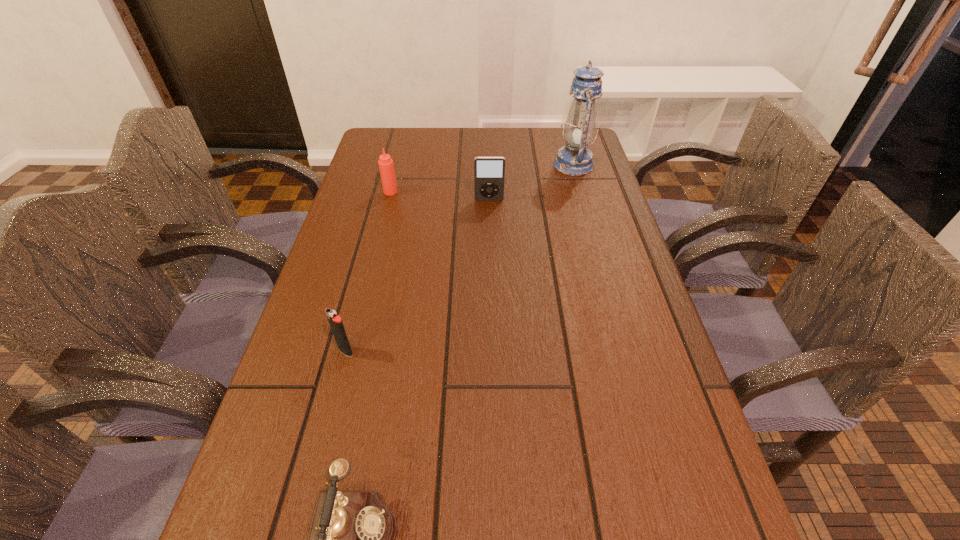
At what (x,y) coordinates should I click in order to perform the action: click on blank area located on the front-facing side of the iPod. Please return your answer as a coordinate pair (x, y). The width and height of the screenshot is (960, 540). Looking at the image, I should click on (491, 272).

The width and height of the screenshot is (960, 540). What are the coordinates of `vacant area located on the right of the second nearest object` in the screenshot? It's located at (486, 351).

The height and width of the screenshot is (540, 960). In order to click on object at the far edge in this screenshot , I will do `click(575, 159)`.

You are a GUI agent. You are given a task and a screenshot of the screen. Output one action in this format:
    pyautogui.click(x=<x>, y=<y>)
    Task: Click on the Tabasco sauce at the left edge
    The image size is (960, 540).
    Given the screenshot: What is the action you would take?
    pyautogui.click(x=386, y=167)

Identify the location of igniter present at the left edge. (336, 324).

Identify the location of object that is at the right edge. (575, 159).

Find the location of a particular element. The width and height of the screenshot is (960, 540). object that is at the far right corner is located at coordinates (575, 159).

Where is `free location at the far edge of the desktop`? Image resolution: width=960 pixels, height=540 pixels. free location at the far edge of the desktop is located at coordinates (448, 135).

You are a GUI agent. You are given a task and a screenshot of the screen. Output one action in this format:
    pyautogui.click(x=<x>, y=<y>)
    Task: Click on the vacant space at the left edge of the desktop
    The width and height of the screenshot is (960, 540).
    Given the screenshot: What is the action you would take?
    pyautogui.click(x=229, y=522)

Locate an element on the screen. vacant space at the right edge of the desktop is located at coordinates (565, 201).